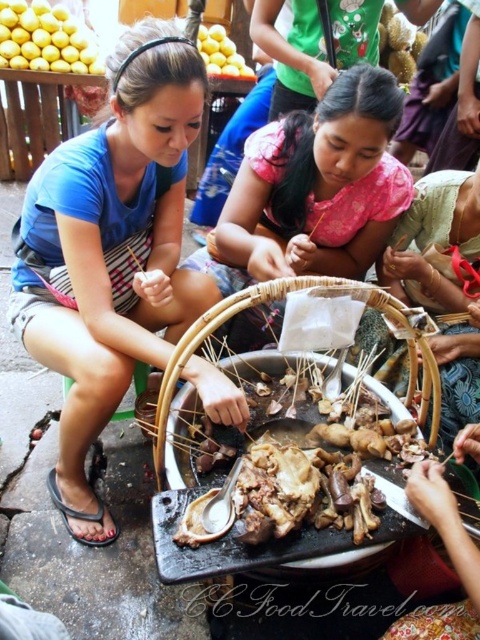
What is located at the point with coordinates (313, 451) in the image?

The point at coordinates (313, 451) is on the brown matte bone at center.

You are a food safety inspector and need to ensure that the brown matte bone at center and the green fabric headscarf at center are kept at least 24 inches apart to comply with health regulations. Based on the scene, are they currently compliant?

A: The brown matte bone at center is 23.29 inches from the green fabric headscarf at center, which is less than the required 24 inches. Therefore, they are not compliant with the health regulations.